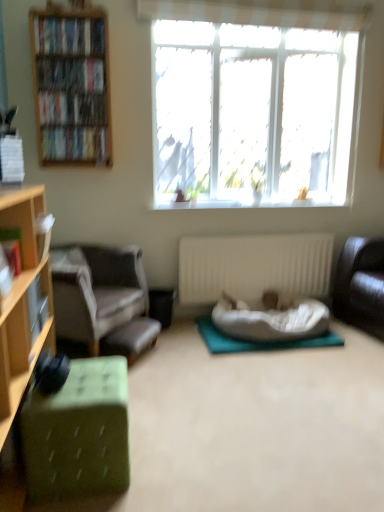
Question: Is gray fabric chair at left shorter than white ribbed radiator at center?

Choices:
 (A) yes
 (B) no

Answer: (B)

Question: Can you confirm if gray fabric chair at left is wider than white ribbed radiator at center?

Choices:
 (A) no
 (B) yes

Answer: (B)

Question: Is gray fabric chair at left at the left side of white ribbed radiator at center?

Choices:
 (A) yes
 (B) no

Answer: (A)

Question: From the image's perspective, is gray fabric chair at left on top of white ribbed radiator at center?

Choices:
 (A) yes
 (B) no

Answer: (B)

Question: Is gray fabric chair at left placed right next to white ribbed radiator at center?

Choices:
 (A) no
 (B) yes

Answer: (A)

Question: Is leather couch at right taller or shorter than green fabric ottoman at lower left?

Choices:
 (A) tall
 (B) short

Answer: (A)

Question: From a real-world perspective, is leather couch at right above or below green fabric ottoman at lower left?

Choices:
 (A) below
 (B) above

Answer: (B)

Question: Do you think leather couch at right is within green fabric ottoman at lower left, or outside of it?

Choices:
 (A) inside
 (B) outside

Answer: (B)

Question: Considering the positions of point (369, 330) and point (64, 381), is point (369, 330) closer or farther from the camera than point (64, 381)?

Choices:
 (A) closer
 (B) farther

Answer: (B)

Question: From the image's perspective, is hardcover book at left, which ranks as the 1th book in front-to-back order, located above or below green fabric footrest at lower left?

Choices:
 (A) above
 (B) below

Answer: (A)

Question: Is hardcover book at left, placed as the 6th book when sorted from back to front, taller or shorter than green fabric footrest at lower left?

Choices:
 (A) short
 (B) tall

Answer: (A)

Question: Is hardcover book at left, which ranks as the 1th book in front-to-back order, in front of or behind green fabric footrest at lower left in the image?

Choices:
 (A) behind
 (B) front

Answer: (B)

Question: Is hardcover book at left, acting as the fifth book starting from the top, bigger or smaller than green fabric footrest at lower left?

Choices:
 (A) big
 (B) small

Answer: (B)

Question: From the image's perspective, is green fabric footrest at lower left positioned above or below white ribbed radiator at center?

Choices:
 (A) below
 (B) above

Answer: (A)

Question: Is green fabric footrest at lower left situated inside white ribbed radiator at center or outside?

Choices:
 (A) outside
 (B) inside

Answer: (A)